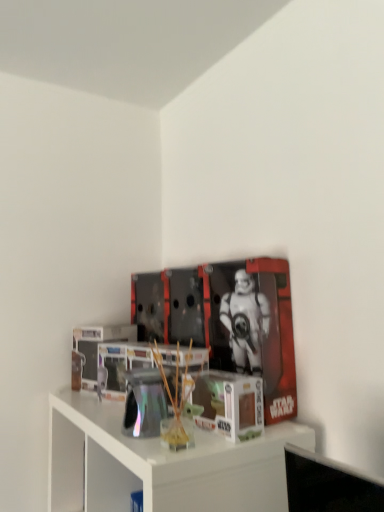
What do you see at coordinates (227, 321) in the screenshot? I see `matte black action figure at upper right` at bounding box center [227, 321].

Find the location of a particular element. This screenshot has width=384, height=512. matte black action figure at upper right is located at coordinates (227, 321).

Where is `matte black action figure at upper right`? matte black action figure at upper right is located at coordinates (227, 321).